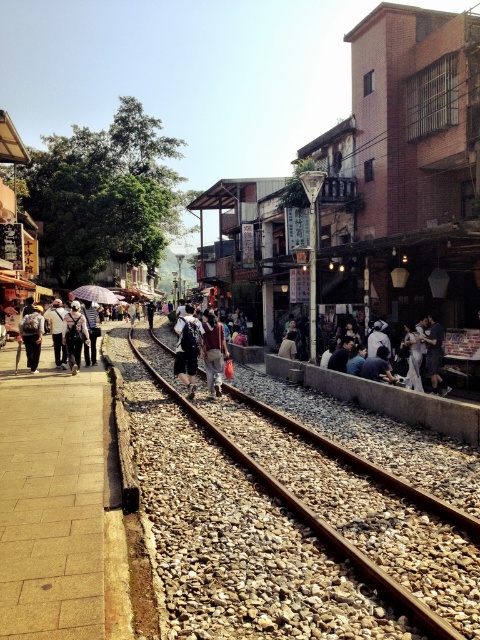
You are a traveler standing on the walkway and see a dark gray backpack at center and a denim jacket at left. Which item is closer to the railway tracks?

The dark gray backpack at center is positioned on the right side of denim jacket at left, meaning it is closer to the railway tracks since the walkway is next to the tracks.

You are a pedestrian standing on the walkway in the street scene. You notice the brown metal track at center and the denim jacket at center. Which object takes up more space in the image?

The brown metal track at center is larger in size than the denim jacket at center, so it takes up more space in the image.